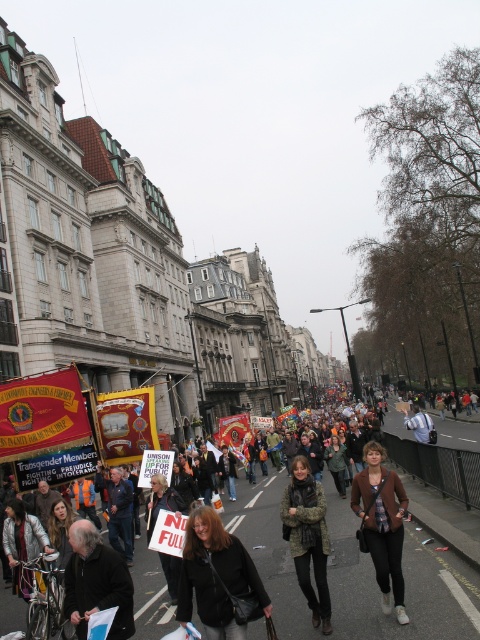
You are a photographer standing at the center of the protest scene. You want to take a photo of the dark gray jacket at lower left. Where should you point your camera?

You should point your camera towards the lower left area at coordinates approximately 0.911 on the x axis and 0.202 on the y axis to capture the dark gray jacket at lower left.

You are a photographer trying to capture a photo of the white fabric sign at center without including the dark gray jacket at lower left. Based on their positions, can you position yourself to the right of the sign to achieve this?

The dark gray jacket at lower left is to the left of the white fabric sign at center. Positioning yourself to the right of the sign would place the jacket to your left, so yes, you can position yourself to the right of the white fabric sign at center to exclude the dark gray jacket at lower left.

You are a photographer standing at the center of the street. You see a point at coordinates point (x=382, y=524). What object is this point located on?

The point (x=382, y=524) is located on the brown fabric jacket at center.